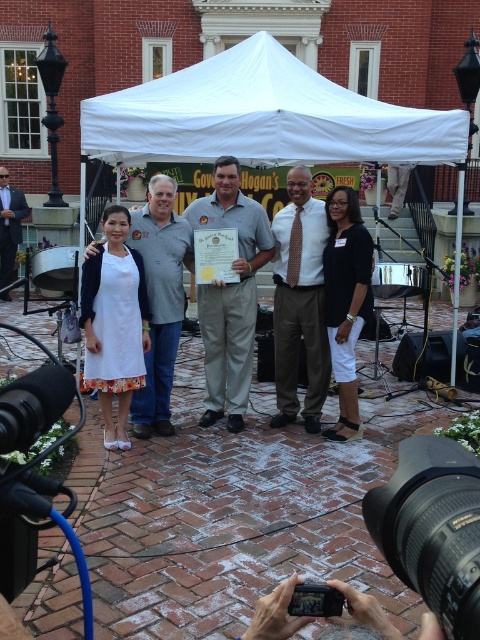
Is point (166, 308) less distant than point (319, 588)?

No, it is not.

Is gray cotton shirt at center to the left of black plastic camera at lower center from the viewer's perspective?

Yes, gray cotton shirt at center is to the left of black plastic camera at lower center.

What do you see at coordinates (159, 300) in the screenshot? I see `gray cotton shirt at center` at bounding box center [159, 300].

In order to click on gray cotton shirt at center in this screenshot , I will do `click(159, 300)`.

In the scene shown: Between black matte pants at center and black plastic camera at lower center, which one appears on the right side from the viewer's perspective?

black matte pants at center is more to the right.

Can you confirm if black matte pants at center is taller than black plastic camera at lower center?

Correct, black matte pants at center is much taller as black plastic camera at lower center.

Who is more distant from viewer, (352, 340) or (322, 588)?

Point (352, 340)

You are a GUI agent. You are given a task and a screenshot of the screen. Output one action in this format:
    pyautogui.click(x=<x>, y=<y>)
    Task: Click on the black matte pants at center
    The height and width of the screenshot is (640, 480).
    Given the screenshot: What is the action you would take?
    pyautogui.click(x=346, y=300)

Is white fabric canopy at center thinner than black matte pants at center?

No, white fabric canopy at center is not thinner than black matte pants at center.

Is white fabric canopy at center to the right of black matte pants at center from the viewer's perspective?

Incorrect, white fabric canopy at center is not on the right side of black matte pants at center.

Describe the element at coordinates (263, 116) in the screenshot. I see `white fabric canopy at center` at that location.

The width and height of the screenshot is (480, 640). In order to click on white fabric canopy at center in this screenshot , I will do `click(263, 116)`.